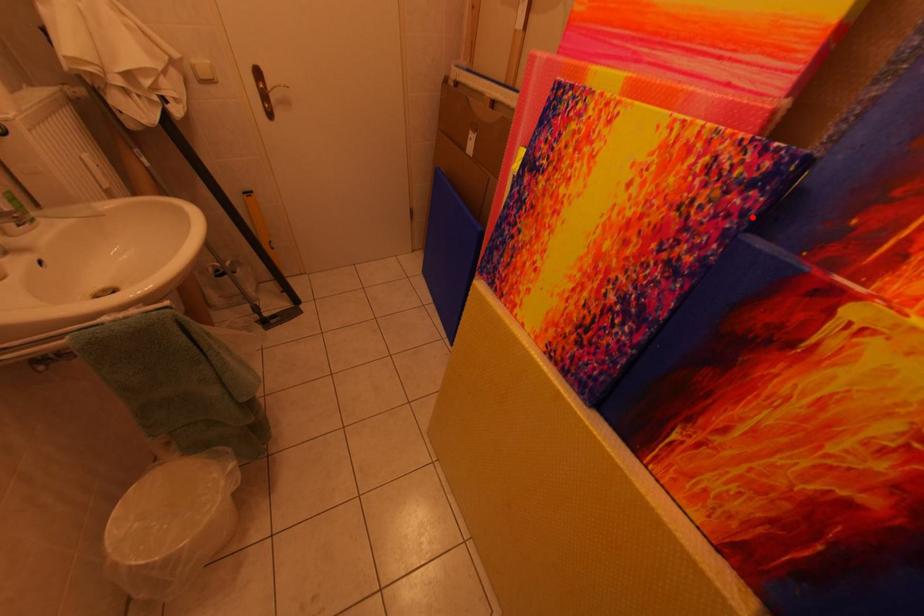
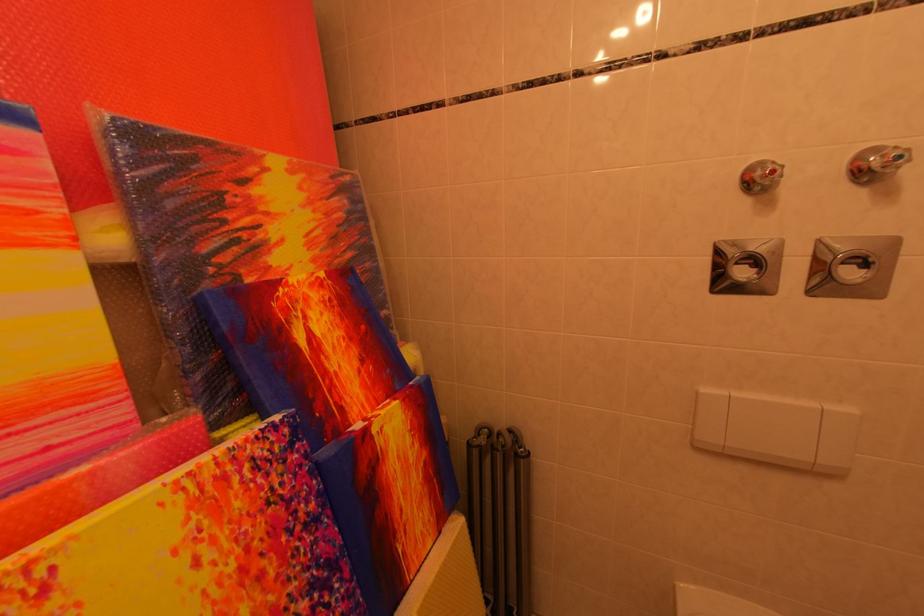
In the second image, find the point that corresponds to the highlighted location in the first image.

(313, 460)